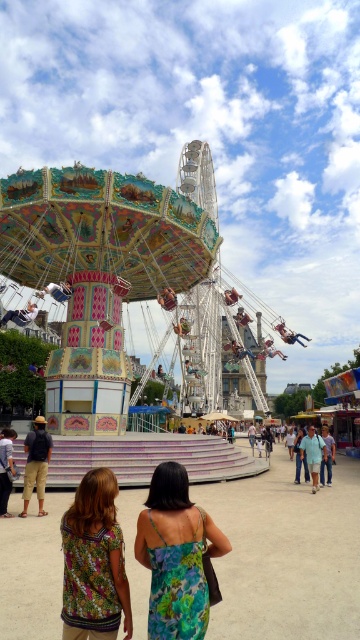
Who is more distant from viewer, (x=64, y=630) or (x=15, y=472)?

Positioned behind is point (x=15, y=472).

Is point (109, 506) closer to camera compared to point (6, 493)?

Yes, it is in front of point (6, 493).

Where is `floral fabric blouse at lower center`? The image size is (360, 640). floral fabric blouse at lower center is located at coordinates (93, 563).

Which is more to the left, green floral dress at center or dark blue denim jeans at lower left?

dark blue denim jeans at lower left is more to the left.

Does green floral dress at center appear over dark blue denim jeans at lower left?

No, green floral dress at center is not above dark blue denim jeans at lower left.

Between point (149, 566) and point (6, 429), which one is positioned in front?

Point (149, 566)

In order to click on green floral dress at center in this screenshot , I will do `click(176, 556)`.

Which is more to the right, green floral dress at center or floral fabric blouse at lower center?

green floral dress at center

Is green floral dress at center wider than floral fabric blouse at lower center?

Yes.

Who is more distant from viewer, (x=173, y=625) or (x=101, y=506)?

The point (x=101, y=506) is more distant.

This screenshot has height=640, width=360. Find the location of `green floral dress at center`. green floral dress at center is located at coordinates (176, 556).